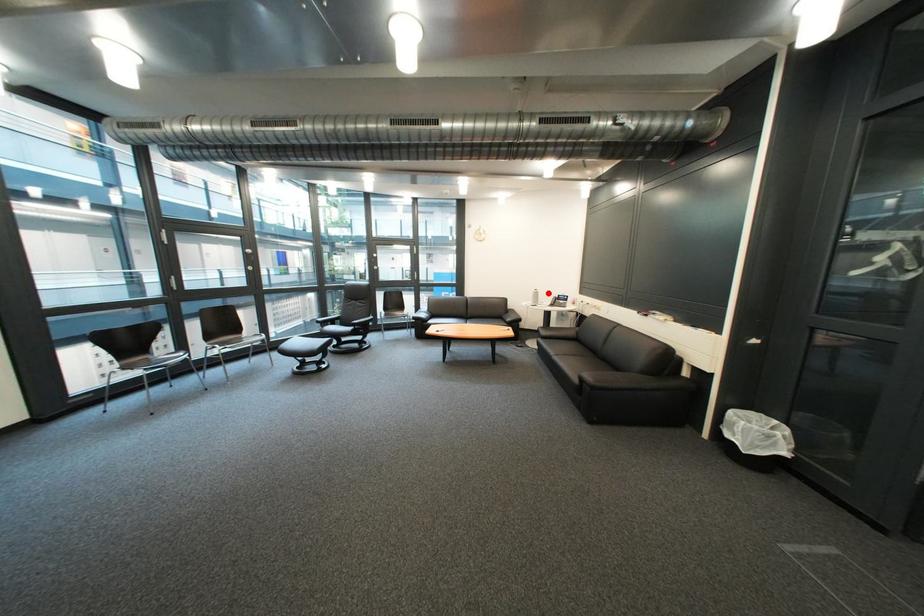
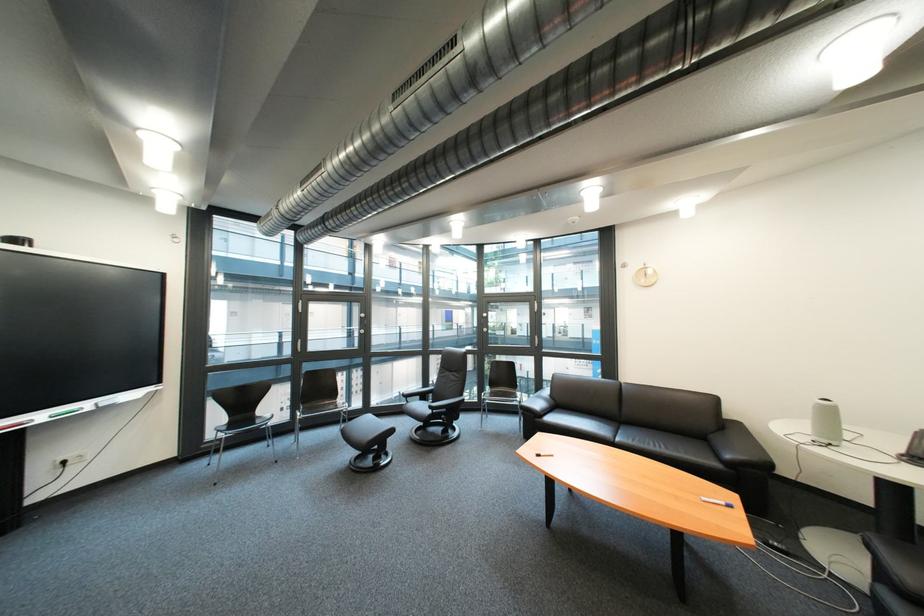
Question: I am providing you with two images of the same scene from different viewpoints. Image1 has a red point marked. In image2, the corresponding 3D location appears at what relative position? Reply with the corresponding letter.

Choices:
 (A) Closer
 (B) Farther

Answer: (B)